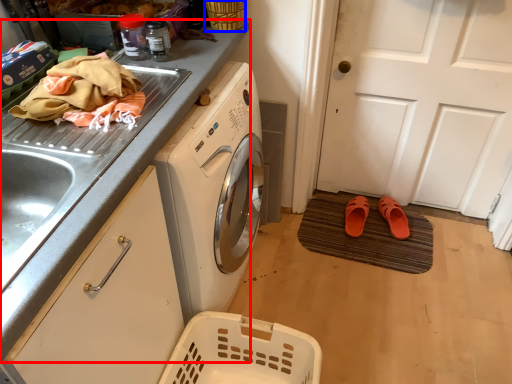
Question: Which of the following is the closest to the observer, countertop (highlighted by a red box) or basket (highlighted by a blue box)?

Choices:
 (A) countertop
 (B) basket

Answer: (A)